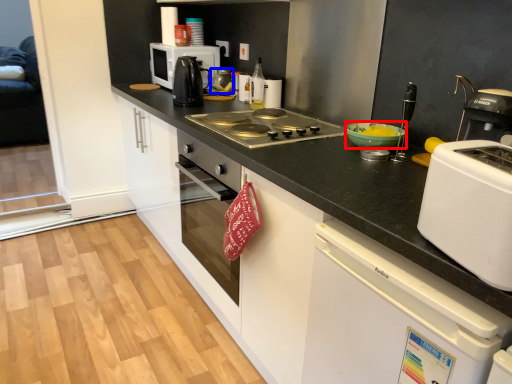
Question: Which object is closer to the camera taking this photo, bowl (highlighted by a red box) or kitchen appliance (highlighted by a blue box)?

Choices:
 (A) bowl
 (B) kitchen appliance

Answer: (A)